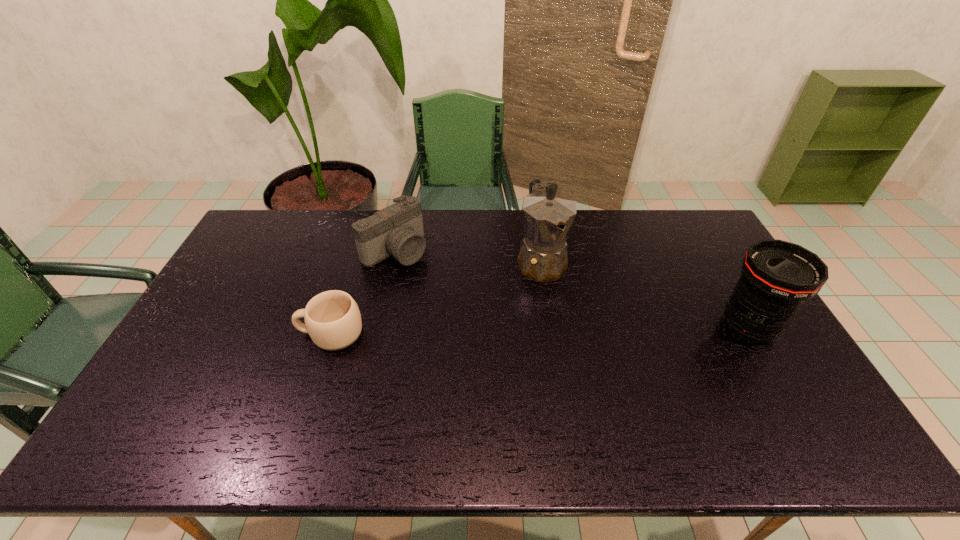
This screenshot has height=540, width=960. Identify the location of free spot on the desktop that is between the mug and the second tallest object and is positioned on the pouring side of the second object from right to left. (575, 329).

Where is `free space on the desktop that is between the mug and the telephoto lens and is positioned at the lens of the camera`? The image size is (960, 540). free space on the desktop that is between the mug and the telephoto lens and is positioned at the lens of the camera is located at coordinates (501, 330).